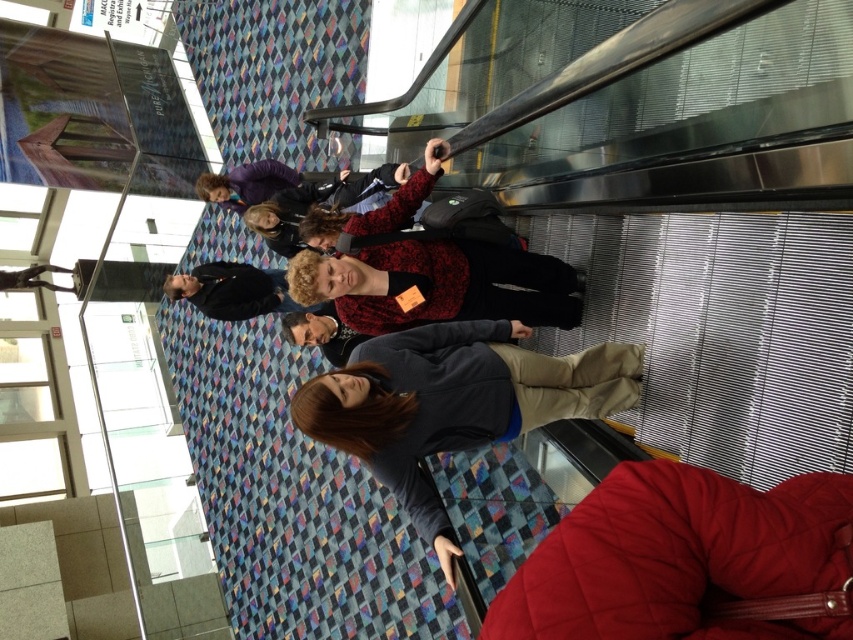
You are standing on the escalator and want to move to the side to let someone pass. Which of the two jackets, the red quilted jacket at lower right or the matte black jacket at upper center, should you move closer to because it is narrower?

The red quilted jacket at lower right has a lesser width compared to the matte black jacket at upper center, so you should move closer to the red quilted jacket at lower right since it is narrower.

You are standing on the escalator and need to pass through the space between the black jacket at center and the metal statue at left. Can you walk through it without touching either?

The black jacket at center might be wider than metal statue at left, so there might not be enough space to walk through without touching either.

In the scene shown: You are standing on the escalator and want to hand a book to the person wearing the black jacket at center. If you can reach 6 feet, will you be able to reach them from where you are standing near the metal statue at left?

The black jacket at center is 6.36 feet away from the metal statue at left. Since your reach is 6 feet, you cannot reach them from that distance.